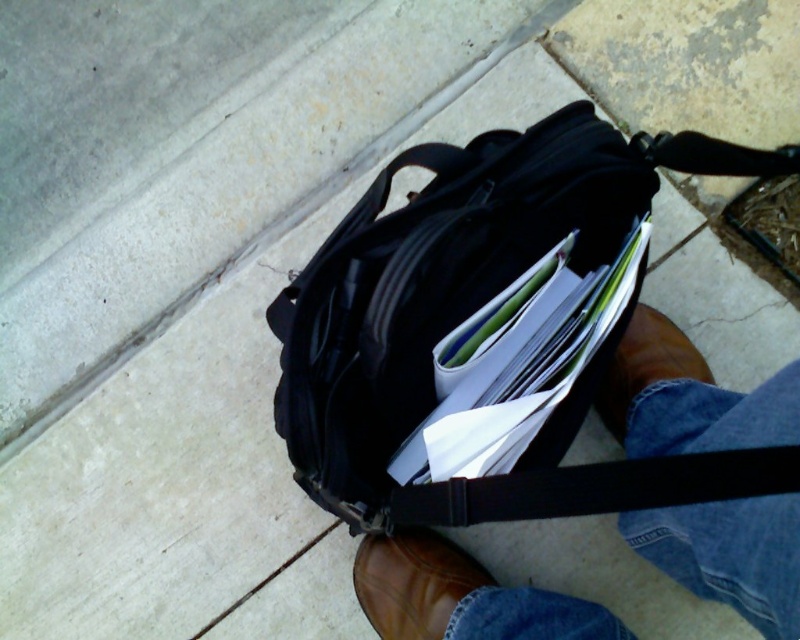
You are a delivery person who needs to deliver a package to the owner of the brown leather shoe at lower center and the brown leather boot at lower center. Which object is closer to the left side of the frame?

The brown leather shoe at lower center is to the left of the brown leather boot at lower center, so the brown leather shoe at lower center is closer to the left side of the frame.

You are a delivery person who needs to step over the items on the ground. You see a brown leather shoe at lower center and a brown leather boot at lower center. Which one should you avoid stepping on to ensure you have enough space?

You should avoid stepping on the brown leather boot at lower center because it occupies more space than the brown leather shoe at lower center, so stepping over the shoe would require less clearance.

You are a photographer trying to capture the black shoulder bag on the sidewalk. You notice two brown leather boots at lower center and a brown leather boot at lower center in the scene. Which of the boots is closer to the camera?

The brown leather boots at lower center is closer to the camera because it is in front of the brown leather boot at lower center.